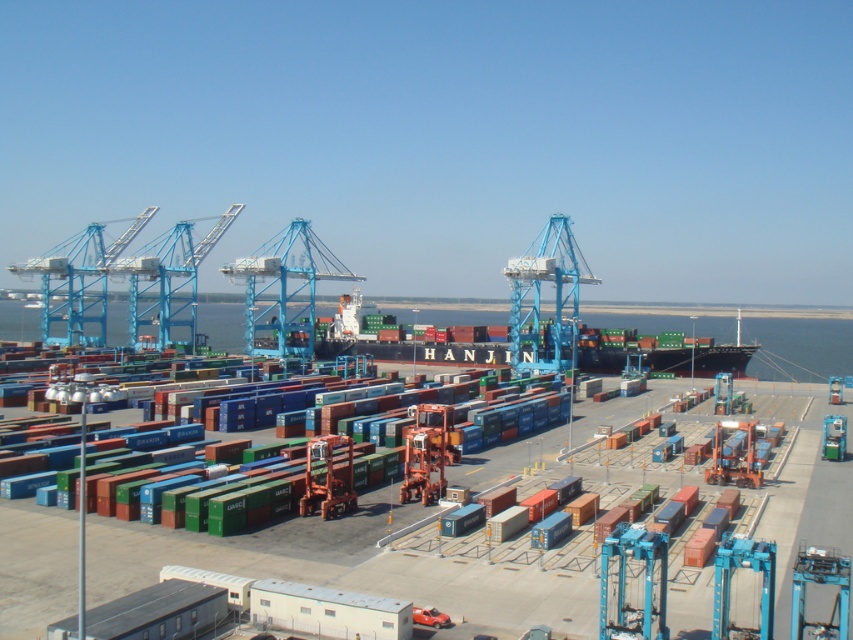
Question: Does black matte water at center appear on the right side of green matte container ship at center?

Choices:
 (A) yes
 (B) no

Answer: (A)

Question: Which point is closer to the camera?

Choices:
 (A) (44, 269)
 (B) (231, 314)

Answer: (A)

Question: Can you confirm if black matte water at center is positioned above green matte container ship at center?

Choices:
 (A) no
 (B) yes

Answer: (A)

Question: Which point is closer to the camera?

Choices:
 (A) (665, 368)
 (B) (433, 314)
 (C) (64, 272)

Answer: (A)

Question: Does black matte water at center appear on the left side of blue metallic crane at left?

Choices:
 (A) yes
 (B) no

Answer: (B)

Question: Which point is closer to the camera?

Choices:
 (A) black matte water at center
 (B) green matte container ship at center
 (C) blue metallic crane at left

Answer: (B)